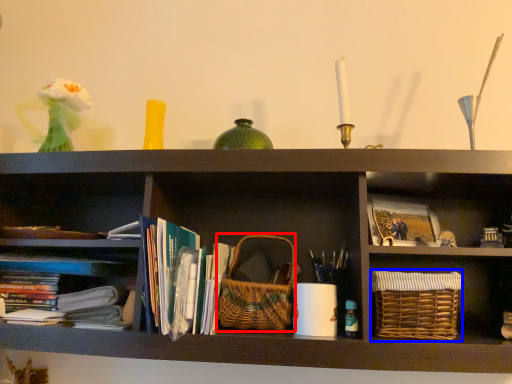
Question: Which of the following is the closest to the observer, basket (highlighted by a red box) or basket (highlighted by a blue box)?

Choices:
 (A) basket
 (B) basket

Answer: (B)